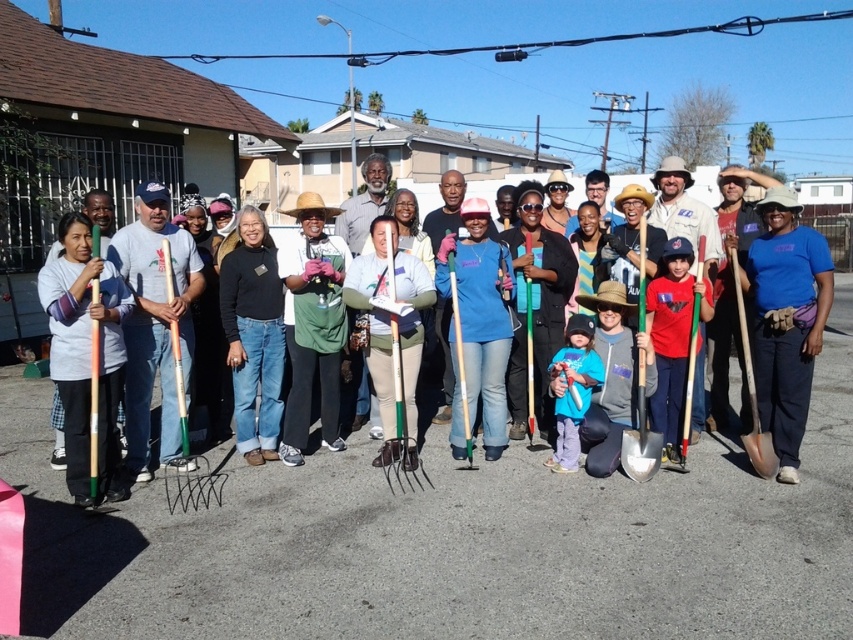
Question: Considering the real-world distances, which object is farthest from the matte wood rake at left?

Choices:
 (A) green plastic rake at center
 (B) matte green rake at center
 (C) blue fabric shirt at center

Answer: (C)

Question: Does black matte jeans at center have a smaller size compared to green plastic rake at center?

Choices:
 (A) yes
 (B) no

Answer: (B)

Question: Which of the following is the farthest from the observer?

Choices:
 (A) (579, 380)
 (B) (442, 291)
 (C) (786, 218)

Answer: (B)

Question: Is matte green rake at center to the right of blue cotton shirt at center from the viewer's perspective?

Choices:
 (A) no
 (B) yes

Answer: (B)

Question: Considering the real-world distances, which object is closest to the blue matte shirt at center?

Choices:
 (A) black matte jeans at center
 (B) blue cotton shirt at center

Answer: (B)

Question: Considering the relative positions of black matte jeans at center and green plastic rake at center in the image provided, where is black matte jeans at center located with respect to green plastic rake at center?

Choices:
 (A) above
 (B) below

Answer: (A)